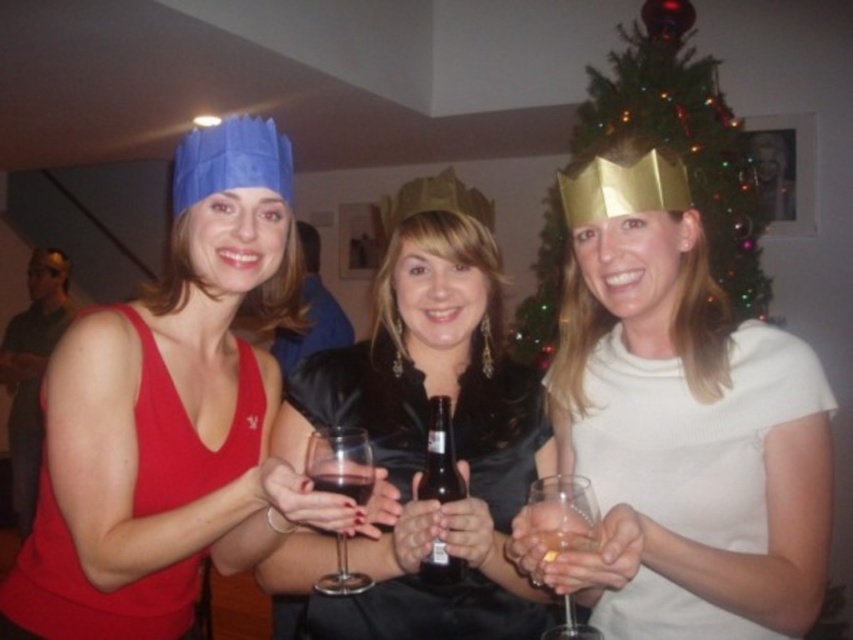
You are at a holiday party and want to grab a drink. You notice the matte red tank top at left and the brown glass bottle at center. Which object is closer to you?

The matte red tank top at left is closer to you because the brown glass bottle at center is behind it.

You are standing in the festive indoor gathering scene. There are two points marked in the image. Which point is closer to you, point [474,545] or point [326,592]?

Point [474,545] is closer to the viewer than point [326,592].